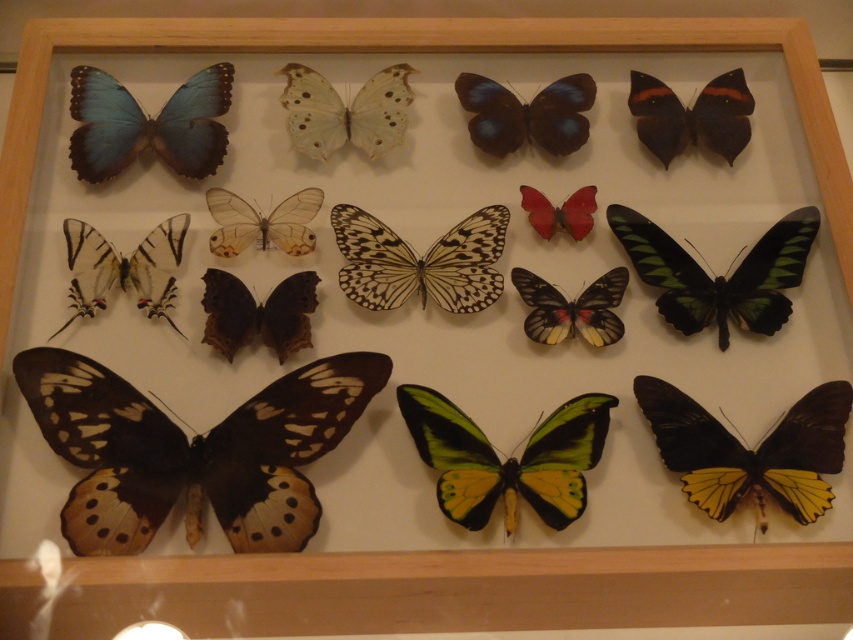
Question: Which of the following is the closest to the observer?

Choices:
 (A) shiny black butterfly at upper right
 (B) green/yellow iridescent butterfly at center
 (C) brown matte butterfly at lower left
 (D) white glossy butterfly at upper left

Answer: (C)

Question: Can you confirm if white glossy butterfly at upper left is positioned above translucent paper-like wings at center?

Choices:
 (A) yes
 (B) no

Answer: (B)

Question: Does shiny blue butterfly at upper center have a smaller size compared to translucent paper-like wings at center?

Choices:
 (A) yes
 (B) no

Answer: (B)

Question: Which point is farther from the camera taking this photo?

Choices:
 (A) (838, 454)
 (B) (341, 113)
 (C) (776, 266)
 (D) (582, 292)

Answer: (B)

Question: Which object is farther from the camera taking this photo?

Choices:
 (A) shiny blue butterfly at upper center
 (B) translucent yellow-green butterfly at center

Answer: (A)

Question: Does green/yellow iridescent butterfly at center have a smaller size compared to matte blue wing at upper left?

Choices:
 (A) no
 (B) yes

Answer: (B)